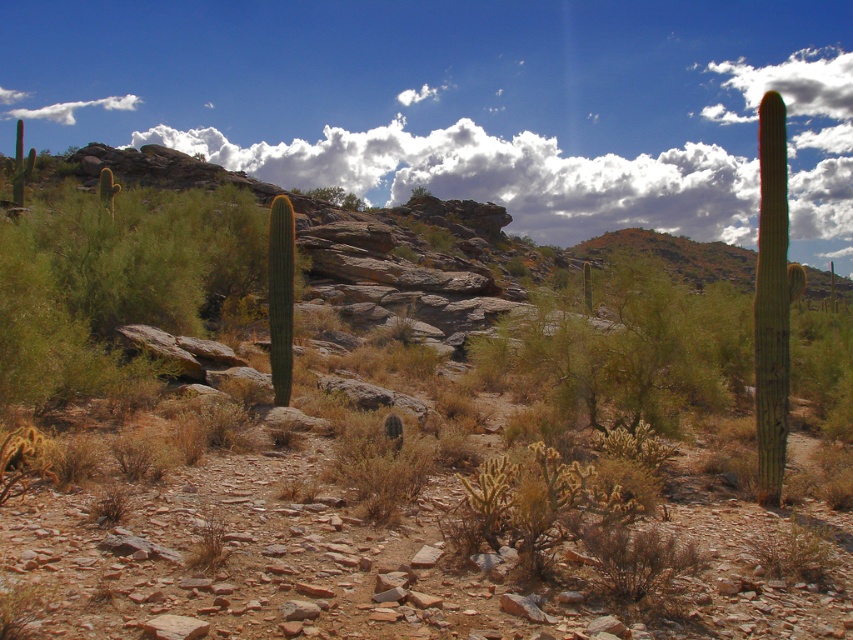
From the picture: Between green fuzzy cactus at center-left and white fluffy cloud at upper left, which one appears on the left side from the viewer's perspective?

From the viewer's perspective, white fluffy cloud at upper left appears more on the left side.

Describe the element at coordinates (163, 252) in the screenshot. The image size is (853, 640). I see `green fuzzy cactus at center-left` at that location.

Find the location of a particular element. green fuzzy cactus at center-left is located at coordinates (163, 252).

Can you confirm if green fuzzy cactus at center-left is wider than white fluffy cloud at upper center?

In fact, green fuzzy cactus at center-left might be narrower than white fluffy cloud at upper center.

Is green fuzzy cactus at center-left shorter than white fluffy cloud at upper center?

Yes.

Which is behind, point (231, 202) or point (744, 93)?

Positioned behind is point (744, 93).

The height and width of the screenshot is (640, 853). I want to click on green fuzzy cactus at center-left, so click(163, 252).

Consider the image. Who is positioned more to the right, white fluffy cloud at upper center or white fluffy cloud at upper left?

Positioned to the right is white fluffy cloud at upper center.

Does point (711, 116) come behind point (33, 116)?

No, it is not.

Find the location of a particular element. white fluffy cloud at upper center is located at coordinates (791, 84).